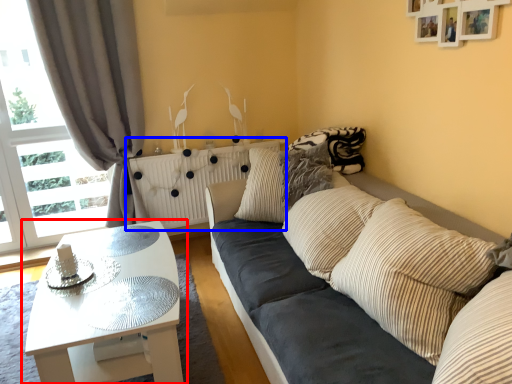
Question: Which point is further to the camera, coffee table (highlighted by a red box) or radiator (highlighted by a blue box)?

Choices:
 (A) coffee table
 (B) radiator

Answer: (B)